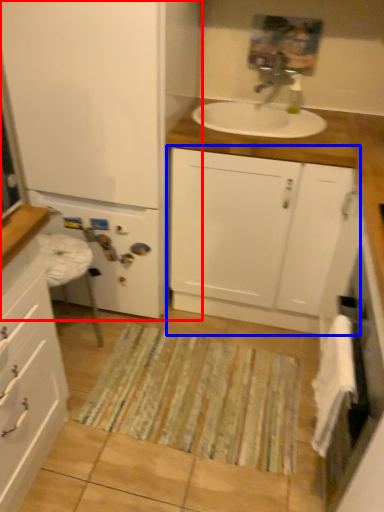
Question: Which object appears closest to the camera in this image, bathroom cabinet (highlighted by a red box) or bathroom cabinet (highlighted by a blue box)?

Choices:
 (A) bathroom cabinet
 (B) bathroom cabinet

Answer: (A)